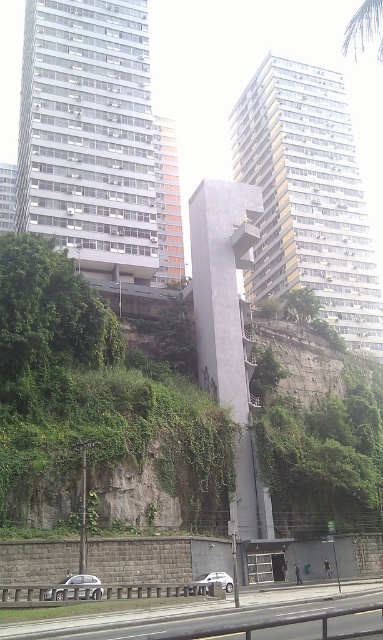
You are a delivery driver who needs to deliver a package to the address located at point (194, 611). According to the image, what is the nearest major road or path you should use to reach that point?

The smooth asphalt highway at lower center is located at point (194, 611), so the nearest major road or path to reach that point is the smooth asphalt highway at lower center.

You are driving along the smooth asphalt highway at lower center and notice the green leafy vegetation at center. Which side of the highway does the vegetation grow on?

The green leafy vegetation at center is positioned on the left side of the smooth asphalt highway at lower center, so it grows on the left side of the highway.

You are a delivery drone flying above the urban landscape. You need to land on the smooth asphalt highway at lower center. What are the coordinates where you should aim to land?

The smooth asphalt highway at lower center is located at coordinates (194, 611). You should aim for those coordinates to land safely.